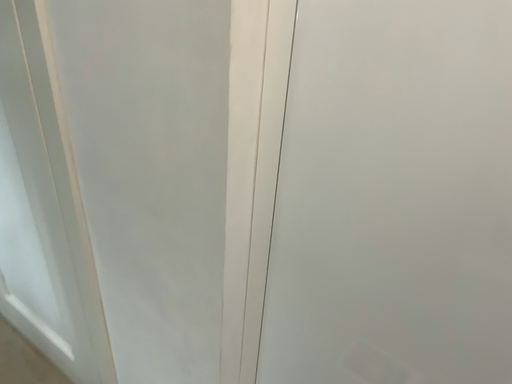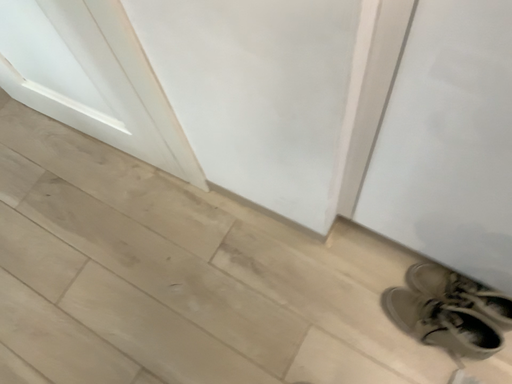
Question: How did the camera likely rotate when shooting the video?

Choices:
 (A) rotated downward
 (B) rotated upward

Answer: (A)